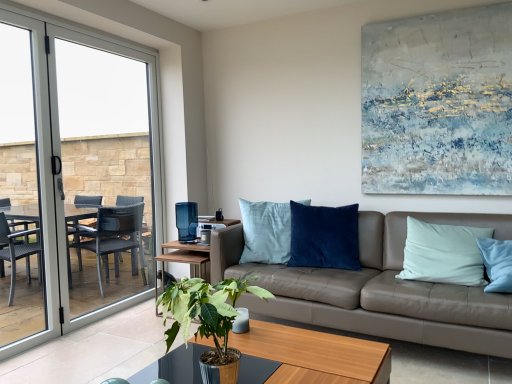
Where is `blank space above textured canvas painting at upper right (from a real-world perspective)`? This screenshot has height=384, width=512. blank space above textured canvas painting at upper right (from a real-world perspective) is located at coordinates (433, 12).